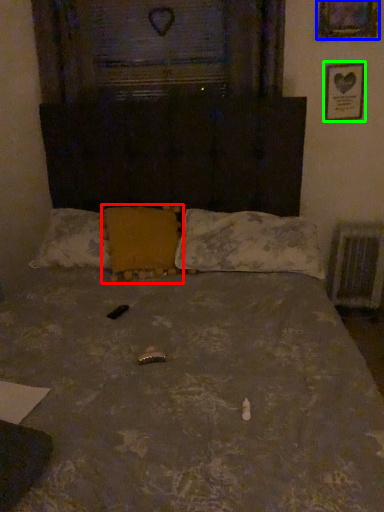
Question: Which object is positioned closest to pillow (highlighted by a red box)? Select from picture frame (highlighted by a blue box) and picture frame (highlighted by a green box).

Choices:
 (A) picture frame
 (B) picture frame

Answer: (B)